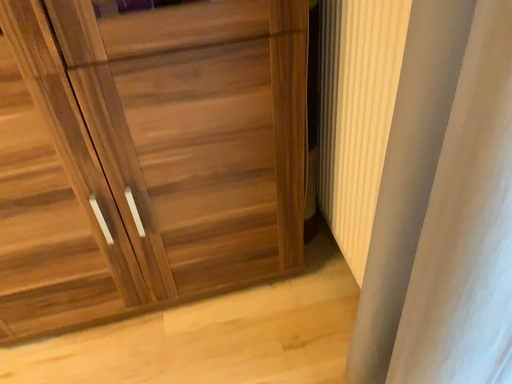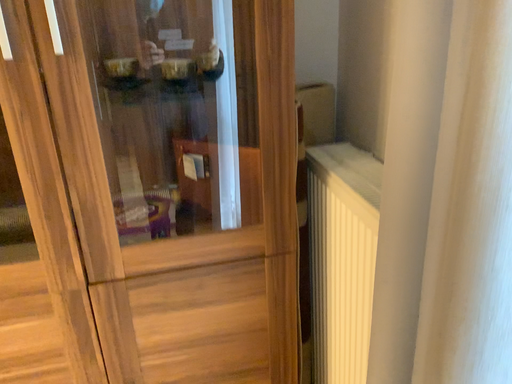
Question: Which way did the camera rotate in the video?

Choices:
 (A) rotated upward
 (B) rotated downward

Answer: (A)